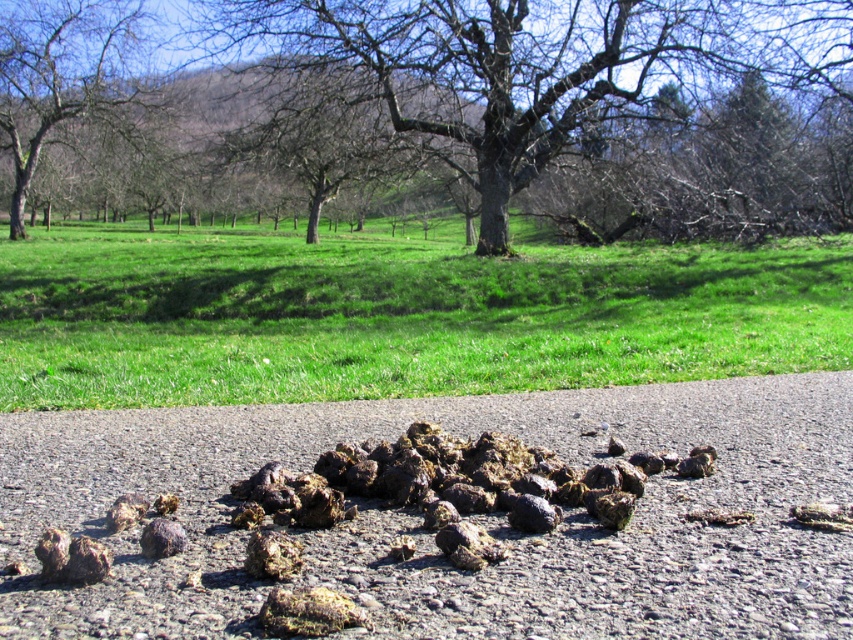
Question: Can you confirm if smooth bark tree at center is bigger than bare wood tree at upper left?

Choices:
 (A) yes
 (B) no

Answer: (A)

Question: Estimate the real-world distances between objects in this image. Which object is closer to the green grass at lower center?

Choices:
 (A) smooth bark tree at center
 (B) bare wood tree at upper left
 (C) rusty metallic rock at lower left

Answer: (A)

Question: Can you confirm if smooth bark tree at center is positioned above rusty metallic rock at lower left?

Choices:
 (A) yes
 (B) no

Answer: (A)

Question: Which point is closer to the camera?

Choices:
 (A) rusty metallic rock at lower left
 (B) smooth bark tree at center
 (C) green grass at lower center

Answer: (A)

Question: Which object is the closest to the smooth bark tree at center?

Choices:
 (A) bare wood tree at upper left
 (B) green grass at lower center

Answer: (B)

Question: Is green grass at lower center smaller than bare wood tree at upper left?

Choices:
 (A) no
 (B) yes

Answer: (A)